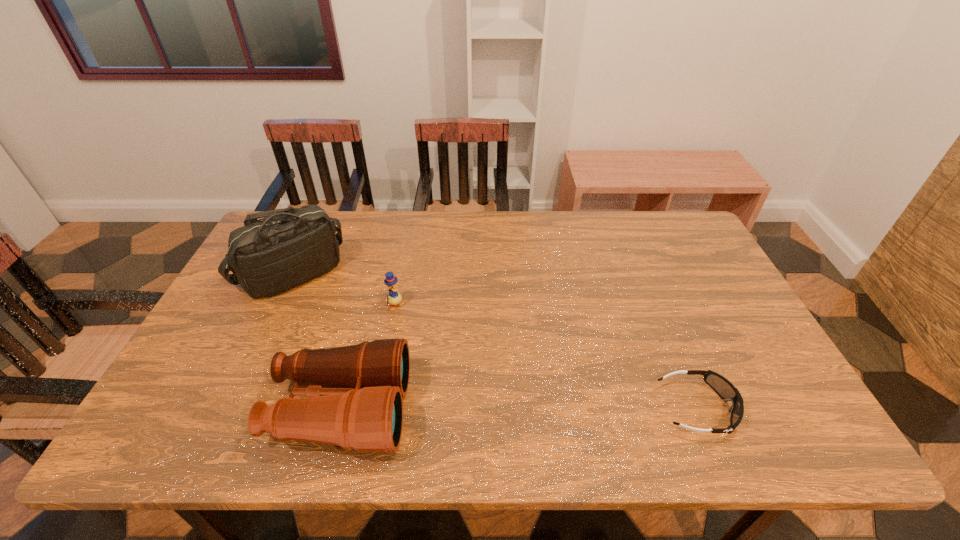
Image resolution: width=960 pixels, height=540 pixels. I want to click on binoculars, so coord(362,409).

Identify the location of the shortest object. (724, 388).

At what (x,y) coordinates should I click in order to perform the action: click on goggles. Please return your answer as a coordinate pair (x, y). The image size is (960, 540). Looking at the image, I should click on (724, 388).

Identify the location of the second shortest object. The height and width of the screenshot is (540, 960). tap(394, 298).

What are the coordinates of `shoulder bag` in the screenshot? It's located at (291, 246).

Locate an element on the screen. free space located on the front and sides of the goggles is located at coordinates (767, 408).

Where is `free space located 0.200m on the face of the duckling, where the monocle is placed`? free space located 0.200m on the face of the duckling, where the monocle is placed is located at coordinates (445, 352).

Locate an element on the screen. This screenshot has width=960, height=540. free space located on the face of the duckling, where the monocle is placed is located at coordinates (433, 341).

Image resolution: width=960 pixels, height=540 pixels. I want to click on free space located on the face of the duckling, where the monocle is placed, so pyautogui.click(x=450, y=357).

This screenshot has height=540, width=960. Identify the location of free space located 0.400m at the front padded panel of the tallest object. (424, 362).